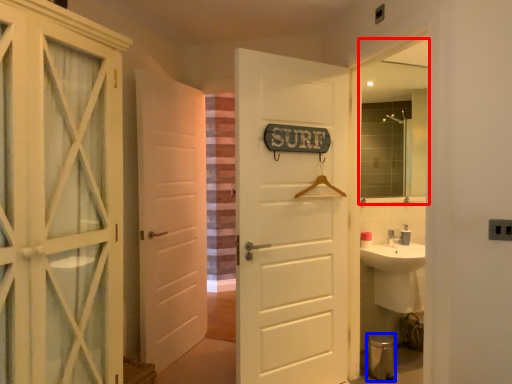
Question: Which object is further to the camera taking this photo, mirror (highlighted by a red box) or toilet bowl (highlighted by a blue box)?

Choices:
 (A) mirror
 (B) toilet bowl

Answer: (A)